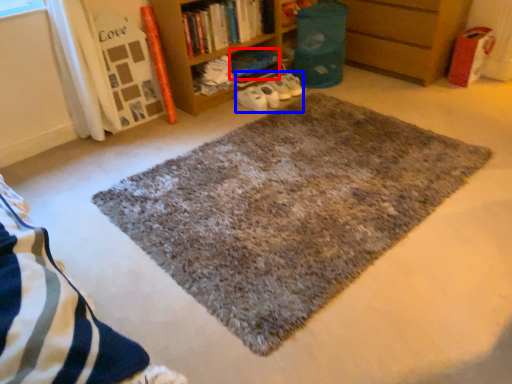
Question: Which object appears closest to the camera in this image, book (highlighted by a red box) or shoe (highlighted by a blue box)?

Choices:
 (A) book
 (B) shoe

Answer: (B)